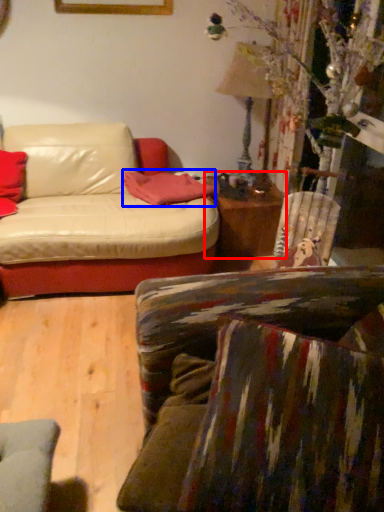
Question: Among these objects, which one is farthest to the camera, table (highlighted by a red box) or pillow (highlighted by a blue box)?

Choices:
 (A) table
 (B) pillow

Answer: (A)